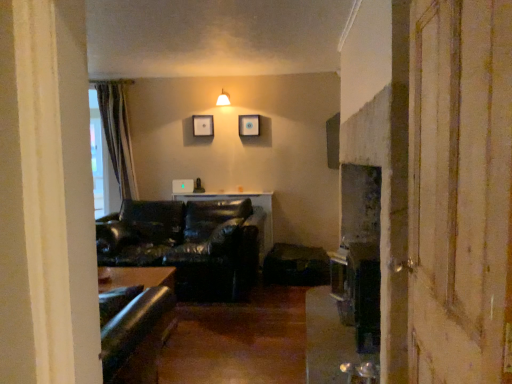
Question: Does wooden picture frame at upper center, which ranks as the 1th picture frame in right-to-left order, have a greater width compared to leather couch at center?

Choices:
 (A) no
 (B) yes

Answer: (A)

Question: Considering the relative sizes of wooden picture frame at upper center, which ranks as the 1th picture frame in right-to-left order, and leather couch at center in the image provided, is wooden picture frame at upper center, which ranks as the 1th picture frame in right-to-left order, taller than leather couch at center?

Choices:
 (A) no
 (B) yes

Answer: (A)

Question: Is wooden picture frame at upper center, arranged as the 2th picture frame when viewed from the left, next to leather couch at center?

Choices:
 (A) no
 (B) yes

Answer: (A)

Question: Does wooden picture frame at upper center, which ranks as the 1th picture frame in right-to-left order, have a lesser width compared to leather couch at center?

Choices:
 (A) yes
 (B) no

Answer: (A)

Question: Is wooden picture frame at upper center, arranged as the 2th picture frame when viewed from the left, oriented towards leather couch at center?

Choices:
 (A) no
 (B) yes

Answer: (A)

Question: From the image's perspective, is wooden picture frame at upper center, which ranks as the 1th picture frame in right-to-left order, below leather couch at center?

Choices:
 (A) yes
 (B) no

Answer: (B)

Question: Considering the relative positions of matte white lampshade at upper center and wooden picture frame at upper center, which ranks as the 1th picture frame in right-to-left order, in the image provided, is matte white lampshade at upper center to the right of wooden picture frame at upper center, which ranks as the 1th picture frame in right-to-left order, from the viewer's perspective?

Choices:
 (A) no
 (B) yes

Answer: (A)

Question: From the image's perspective, would you say matte white lampshade at upper center is positioned over wooden picture frame at upper center, arranged as the 2th picture frame when viewed from the left?

Choices:
 (A) yes
 (B) no

Answer: (A)

Question: Does matte white lampshade at upper center have a greater width compared to wooden picture frame at upper center, which ranks as the 1th picture frame in right-to-left order?

Choices:
 (A) no
 (B) yes

Answer: (B)

Question: From a real-world perspective, is matte white lampshade at upper center physically above wooden picture frame at upper center, arranged as the 2th picture frame when viewed from the left?

Choices:
 (A) no
 (B) yes

Answer: (B)

Question: Is matte white lampshade at upper center bigger than wooden picture frame at upper center, which ranks as the 1th picture frame in right-to-left order?

Choices:
 (A) yes
 (B) no

Answer: (A)

Question: Does matte white lampshade at upper center have a lesser height compared to wooden picture frame at upper center, arranged as the 2th picture frame when viewed from the left?

Choices:
 (A) no
 (B) yes

Answer: (B)

Question: Does matte white lampshade at upper center have a larger size compared to matte black picture frame at upper center, which ranks as the second picture frame in right-to-left order?

Choices:
 (A) no
 (B) yes

Answer: (B)